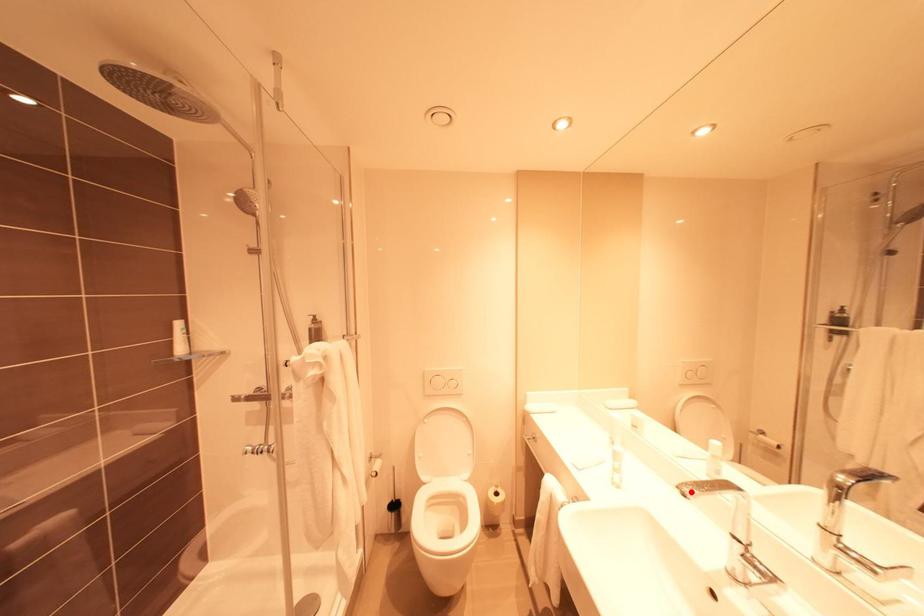
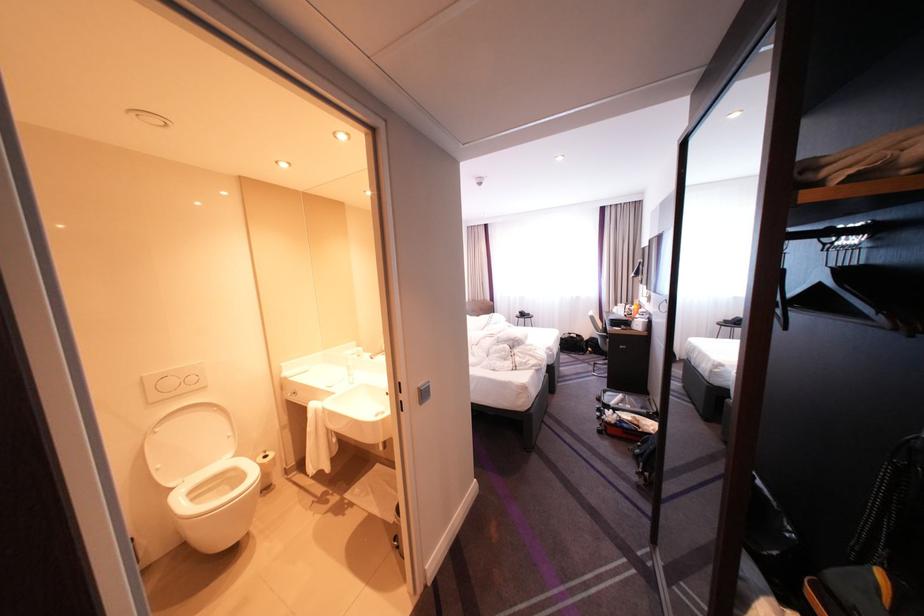
Locate, in the second image, the point that corresponds to the highlighted location in the first image.

(382, 359)